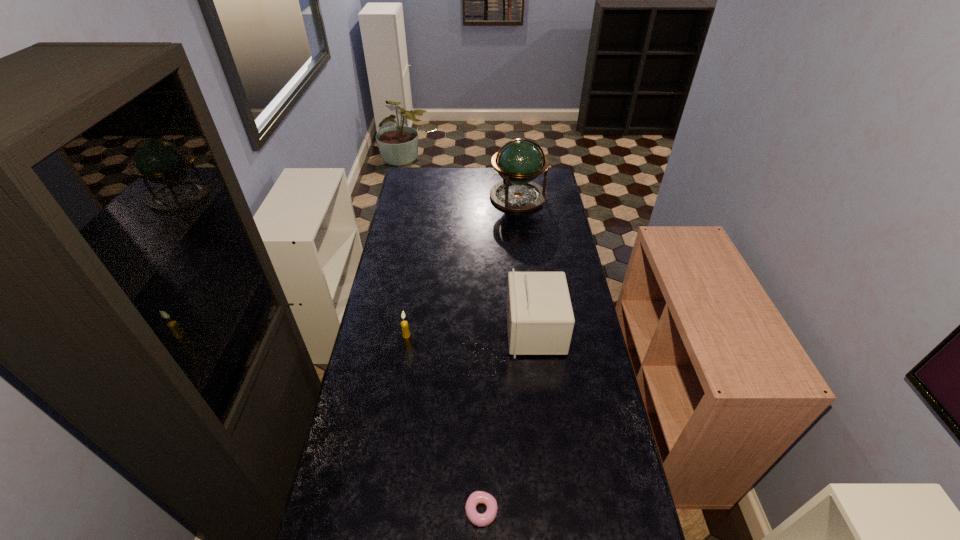
Where is `the farthest object`? The height and width of the screenshot is (540, 960). the farthest object is located at coordinates 520,161.

Where is `globe`? globe is located at coordinates (520, 161).

You are a GUI agent. You are given a task and a screenshot of the screen. Output one action in this format:
    pyautogui.click(x=<x>, y=<y>)
    Task: Click on the first-aid kit
    The image size is (960, 540).
    Given the screenshot: What is the action you would take?
    pyautogui.click(x=540, y=320)

Locate an element on the screen. This screenshot has height=540, width=960. the third tallest object is located at coordinates (404, 324).

Identify the location of the leftmost object. The width and height of the screenshot is (960, 540). (404, 324).

In order to click on the third object from right to left in this screenshot , I will do tap(477, 497).

This screenshot has width=960, height=540. I want to click on the shortest object, so [x=477, y=497].

Locate an element on the screen. Image resolution: width=960 pixels, height=540 pixels. vacant position located 0.380m on the front-facing side of the farthest object is located at coordinates (525, 262).

This screenshot has width=960, height=540. In order to click on free spot located on the front-facing side of the first-aid kit in this screenshot , I will do `click(465, 330)`.

Find the location of a particular element. The image size is (960, 540). free space located on the front-facing side of the first-aid kit is located at coordinates (463, 330).